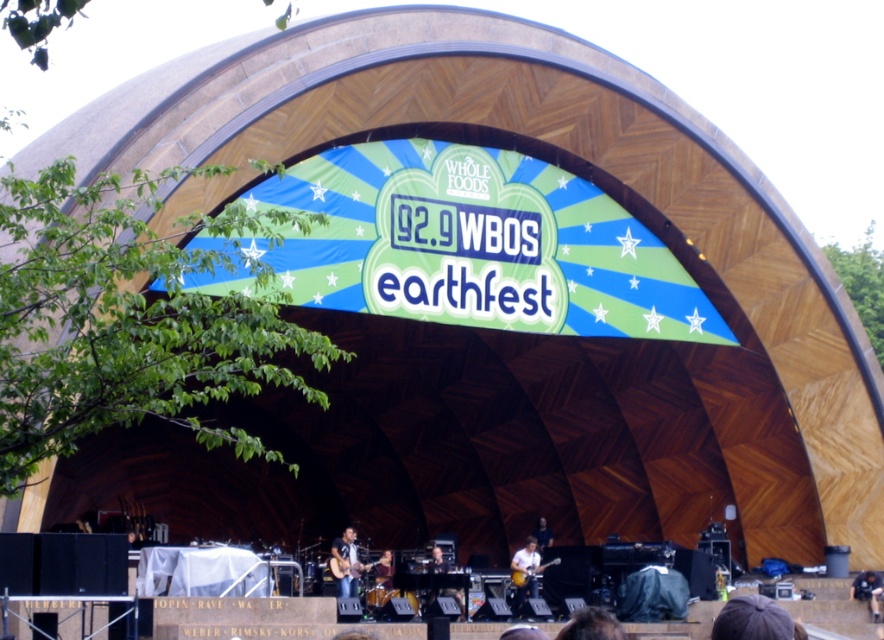
Question: Based on their relative distances, which object is nearer to the shiny brown guitar at center?

Choices:
 (A) matte brown guitar at center
 (B) brown hair at lower center
 (C) dark blue jeans at lower right
 (D) dark brown leather jacket at lower center

Answer: (A)

Question: Which object appears closest to the camera in this image?

Choices:
 (A) dark blue jeans at lower right
 (B) brown hair at lower center
 (C) matte brown guitar at center
 (D) dark brown leather jacket at lower center

Answer: (B)

Question: Does matte brown guitar at center have a larger size compared to shiny brown guitar at center?

Choices:
 (A) yes
 (B) no

Answer: (A)

Question: Does matte brown guitar at center appear on the left side of matte white guitar at center?

Choices:
 (A) no
 (B) yes

Answer: (B)

Question: Which object appears closest to the camera in this image?

Choices:
 (A) matte brown guitar at center
 (B) matte white guitar at center
 (C) brown fabric cap at lower center

Answer: (C)

Question: Does matte brown guitar at center appear under matte white guitar at center?

Choices:
 (A) no
 (B) yes

Answer: (A)